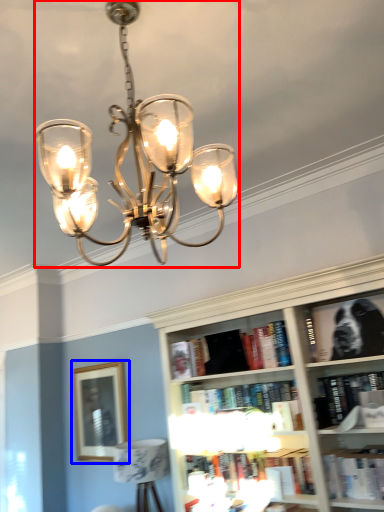
Question: Which of the following is the farthest to the observer, lamp (highlighted by a red box) or picture frame (highlighted by a blue box)?

Choices:
 (A) lamp
 (B) picture frame

Answer: (B)